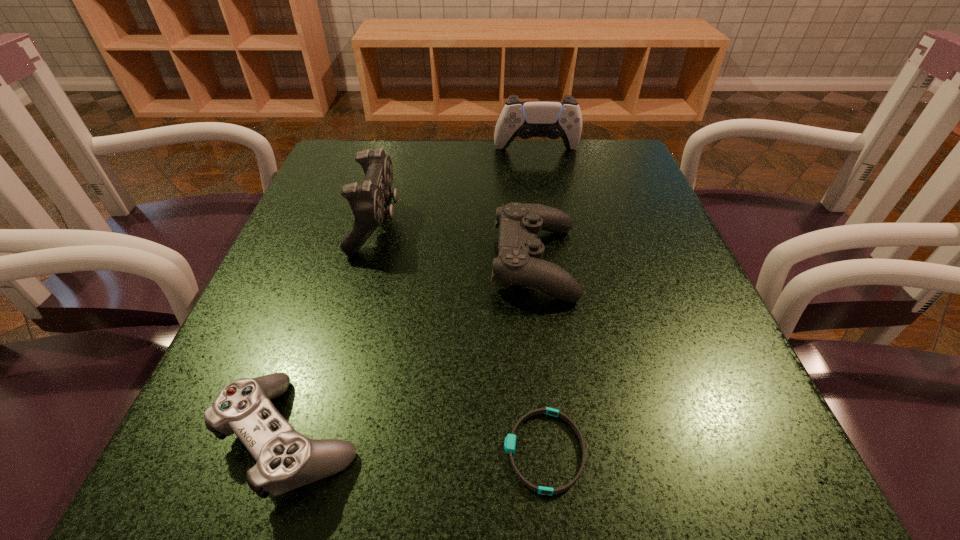
The height and width of the screenshot is (540, 960). I want to click on the farthest control, so click(x=553, y=119).

The image size is (960, 540). Find the location of `the second shortest control`. the second shortest control is located at coordinates (519, 262).

At what (x,y) coordinates should I click in order to perform the action: click on the nearest control. Please return your answer as a coordinate pair (x, y). Looking at the image, I should click on (286, 459).

In order to click on the fourth tallest object in this screenshot , I will do `click(286, 459)`.

The width and height of the screenshot is (960, 540). I want to click on the shortest object, so 510,441.

The height and width of the screenshot is (540, 960). Identify the location of free point located on the front-facing side of the farthest object. (549, 217).

You are a GUI agent. You are given a task and a screenshot of the screen. Output one action in this format:
    pyautogui.click(x=<x>, y=<y>)
    Task: Click on the vacant area located on the back of the second shortest control
    
    Given the screenshot: What is the action you would take?
    pyautogui.click(x=522, y=167)

You are a GUI agent. You are given a task and a screenshot of the screen. Output one action in this format:
    pyautogui.click(x=<x>, y=<y>)
    Task: Click on the blank space located 0.190m on the back of the fourth tallest object
    This screenshot has height=540, width=960.
    Given the screenshot: What is the action you would take?
    pyautogui.click(x=342, y=282)

Locate an element on the screen. The width and height of the screenshot is (960, 540). vacant space located on the buckle of the shortest object is located at coordinates (373, 451).

Locate an element on the screen. This screenshot has height=540, width=960. vacant space situated 0.300m on the buckle of the shortest object is located at coordinates (258, 451).